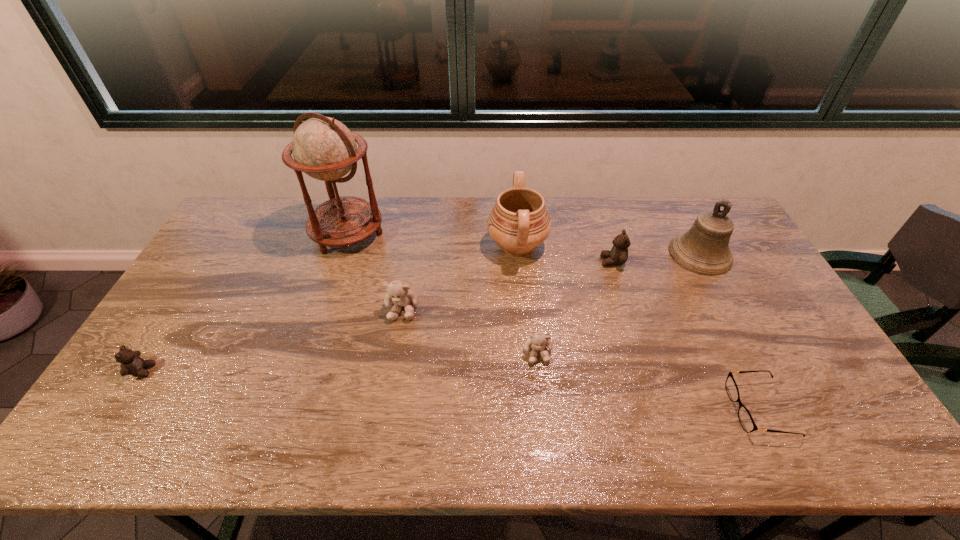
Identify which teddy bear is located as the second nearest to the spectacles. Please provide its 2D coordinates. Your answer should be formatted as a tuple, i.e. [(x, y)], where the tuple contains the x and y coordinates of a point satisfying the conditions above.

[(538, 341)]

Image resolution: width=960 pixels, height=540 pixels. Find the location of `free space that satisfies the following two spatial constraints: 1. on the front-facing side of the urn; 2. on the left side of the bell`. free space that satisfies the following two spatial constraints: 1. on the front-facing side of the urn; 2. on the left side of the bell is located at coordinates point(518,254).

What are the coordinates of `free space that satisfies the following two spatial constraints: 1. on the front-facing side of the urn; 2. on the face of the farther gray teddy bear` in the screenshot? It's located at (523, 308).

Identify the location of free spot that satisfies the following two spatial constraints: 1. on the front side of the bell; 2. on the face of the leftmost teddy bear. Image resolution: width=960 pixels, height=540 pixels. (761, 370).

Where is `free space that satisfies the following two spatial constraints: 1. on the front side of the bell; 2. on the face of the leftmost teddy bear`? Image resolution: width=960 pixels, height=540 pixels. free space that satisfies the following two spatial constraints: 1. on the front side of the bell; 2. on the face of the leftmost teddy bear is located at coordinates (761, 370).